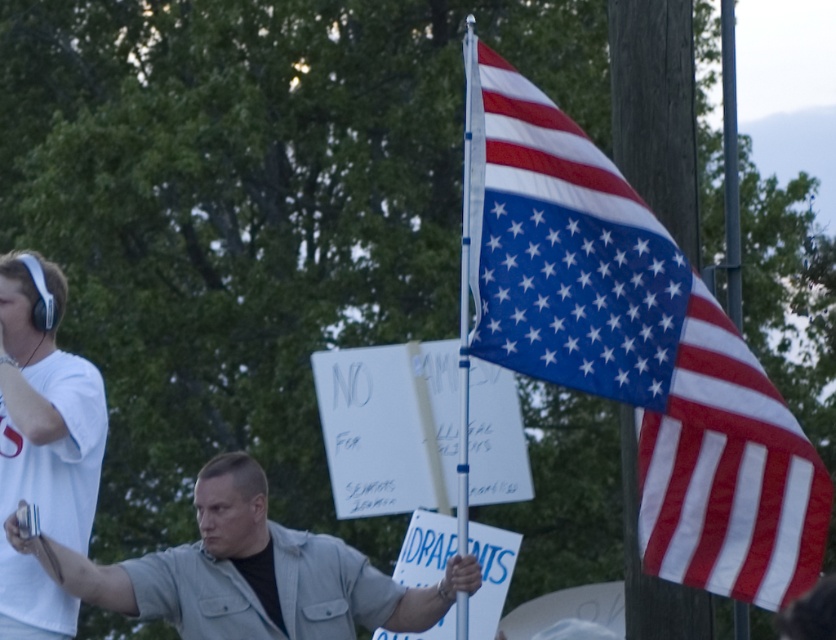
You are a photographer trying to capture a wide shot of the protest scene. The light gray denim jacket at center and the white matte headphones at upper left are in your frame. Since you want to emphasize the central figure, which object should you focus on to ensure it appears larger in the photo?

The light gray denim jacket at center should be focused on because its width surpasses that of the white matte headphones at upper left, making it naturally larger in the frame.

You are a photographer standing at the camera position. You want to capture a closeup shot of the polyester american flag at right. Considering the distance between you and the flag, what is the minimum focal length lens you need to use if your camera sensor is 35mm and you want the flag to fill 80 percent of the frame?

The minimum focal length lens required is approximately 200mm. This is calculated using the formula for focal length based on distance and desired field of view, ensuring the polyester american flag at right fills 80 percent of the 35mm sensor frame at 9.52 meters distance.

You are a photographer trying to capture both the polyester american flag at right and the light gray denim jacket at center in a single frame. Which object should you focus on first to ensure it appears larger in the photo?

The light gray denim jacket at center should be focused on first since it has a greater width than the polyester american flag at right, making it naturally appear larger in the photo.